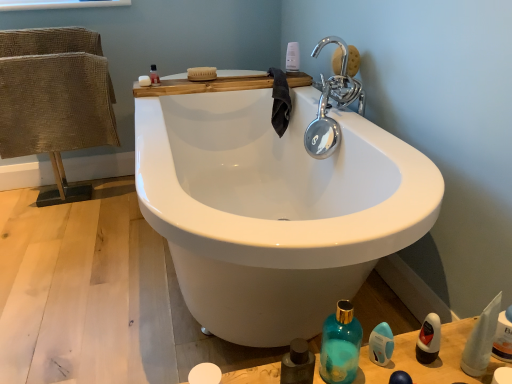
Question: Can you confirm if black plastic bottle at lower right, which is the first mouthwash from right to left, is thinner than teal glass bottle at lower right?

Choices:
 (A) yes
 (B) no

Answer: (A)

Question: Considering the relative positions of black plastic bottle at lower right, which is the second mouthwash from top to bottom, and teal glass bottle at lower right in the image provided, is black plastic bottle at lower right, which is the second mouthwash from top to bottom, to the left of teal glass bottle at lower right from the viewer's perspective?

Choices:
 (A) no
 (B) yes

Answer: (A)

Question: Is black plastic bottle at lower right, arranged as the 3th mouthwash when viewed from the left, shorter than teal glass bottle at lower right?

Choices:
 (A) no
 (B) yes

Answer: (B)

Question: Considering the relative positions of black plastic bottle at lower right, the 2th mouthwash ordered from the bottom, and teal glass bottle at lower right in the image provided, is black plastic bottle at lower right, the 2th mouthwash ordered from the bottom, to the right of teal glass bottle at lower right from the viewer's perspective?

Choices:
 (A) no
 (B) yes

Answer: (B)

Question: From the image's perspective, is black plastic bottle at lower right, the 2th mouthwash ordered from the bottom, located above teal glass bottle at lower right?

Choices:
 (A) yes
 (B) no

Answer: (B)

Question: Does black plastic bottle at lower right, which is the second mouthwash from top to bottom, have a smaller size compared to teal glass bottle at lower right?

Choices:
 (A) no
 (B) yes

Answer: (B)

Question: Is white plastic bottle at upper center, placed as the first toiletry when sorted from top to bottom, far from white fabric towel at lower right, arranged as the 1th toiletry when viewed from the right?

Choices:
 (A) yes
 (B) no

Answer: (A)

Question: Is white plastic bottle at upper center, the second toiletry in the right-to-left sequence, outside white fabric towel at lower right, which is counted as the third toiletry, starting from the left?

Choices:
 (A) yes
 (B) no

Answer: (A)

Question: Is the position of white plastic bottle at upper center, the 2th toiletry from the left, less distant than that of white fabric towel at lower right, the 2th toiletry ordered from the bottom?

Choices:
 (A) no
 (B) yes

Answer: (A)

Question: From a real-world perspective, does white plastic bottle at upper center, placed as the 3th toiletry when sorted from bottom to top, stand above white fabric towel at lower right, the 2th toiletry ordered from the bottom?

Choices:
 (A) yes
 (B) no

Answer: (A)

Question: Is white plastic bottle at upper center, the 2th toiletry from the left, touching white fabric towel at lower right, which is counted as the third toiletry, starting from the left?

Choices:
 (A) yes
 (B) no

Answer: (B)

Question: Considering the relative sizes of white plastic bottle at upper center, the second toiletry in the right-to-left sequence, and white fabric towel at lower right, arranged as the 1th toiletry when viewed from the right, in the image provided, is white plastic bottle at upper center, the second toiletry in the right-to-left sequence, thinner than white fabric towel at lower right, arranged as the 1th toiletry when viewed from the right,?

Choices:
 (A) no
 (B) yes

Answer: (B)

Question: Can you confirm if translucent plastic mouthwash at upper left, arranged as the 1th mouthwash when viewed from the left, is wider than teal glass bottle at lower right?

Choices:
 (A) yes
 (B) no

Answer: (B)